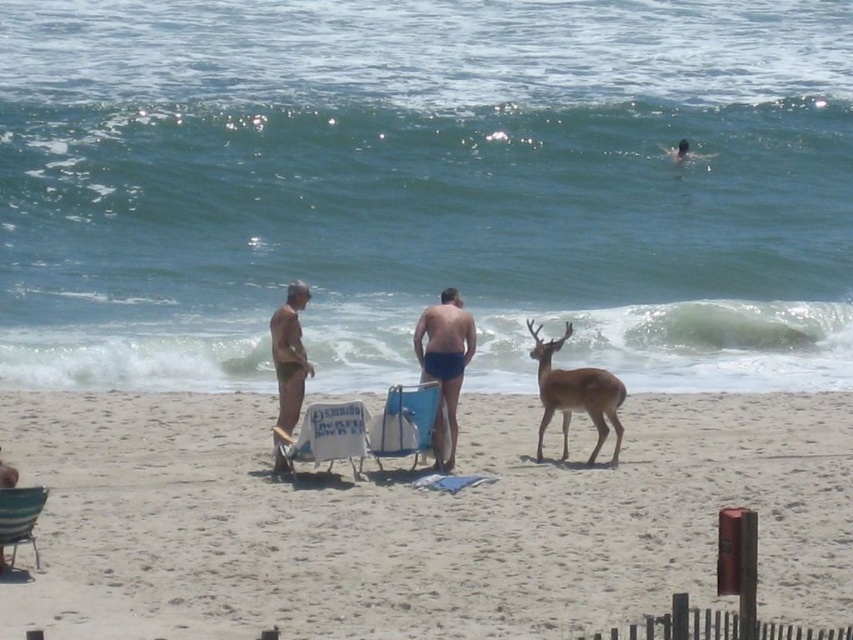
You are a person who wants to place a 3 feet long surfboard between the beige sand at center and the white fabric beach chair at center. Can you fit it there?

The distance between the beige sand at center and the white fabric beach chair at center is 6.39 feet. Since the surfboard is 3 feet long, it can be placed there as the space is sufficient.